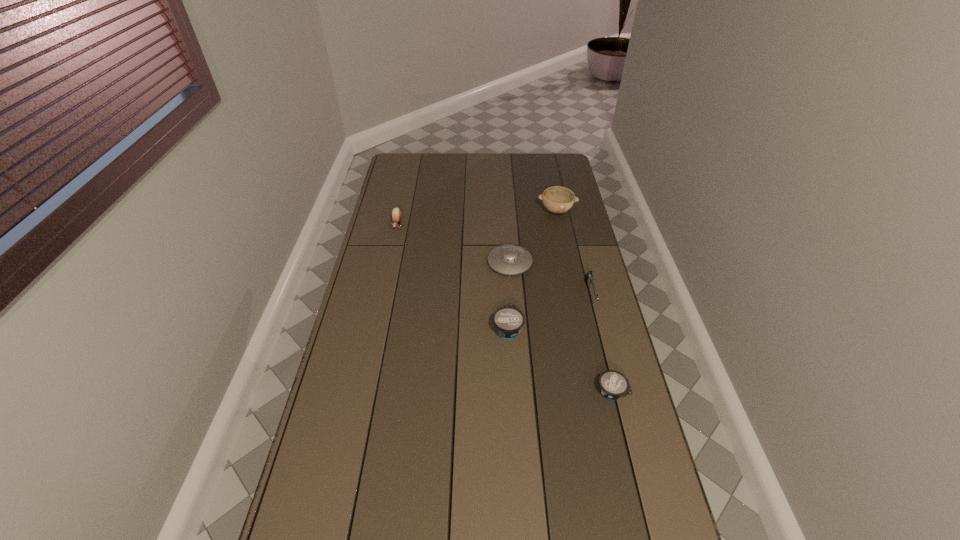
All yogurts are currently evenly spaced. To continue this pattern, where would you add another yogurt on the left? Please point out a vacant spot. Please provide its 2D coordinates. Your answer should be formatted as a tuple, i.e. [(x, y)], where the tuple contains the x and y coordinates of a point satisfying the conditions above.

[(425, 279)]